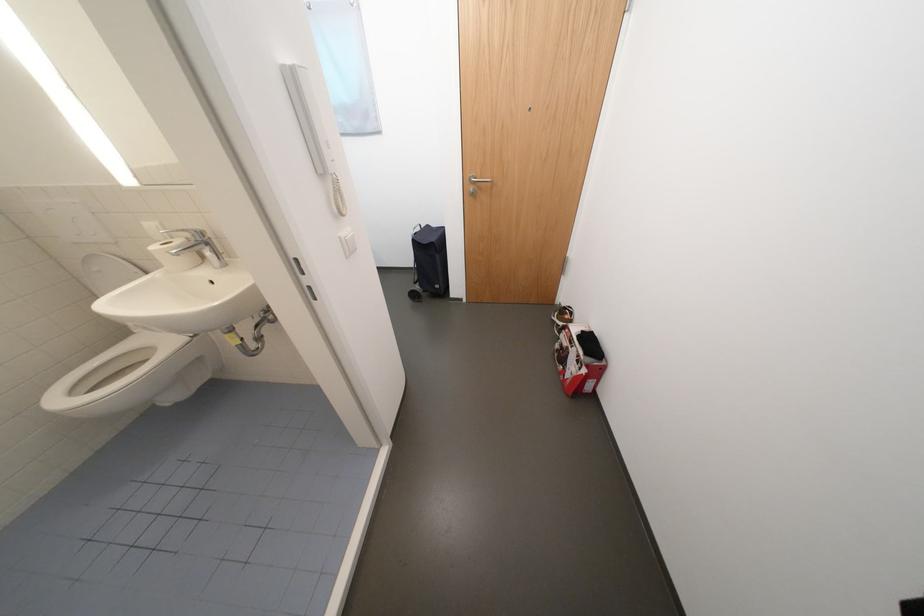
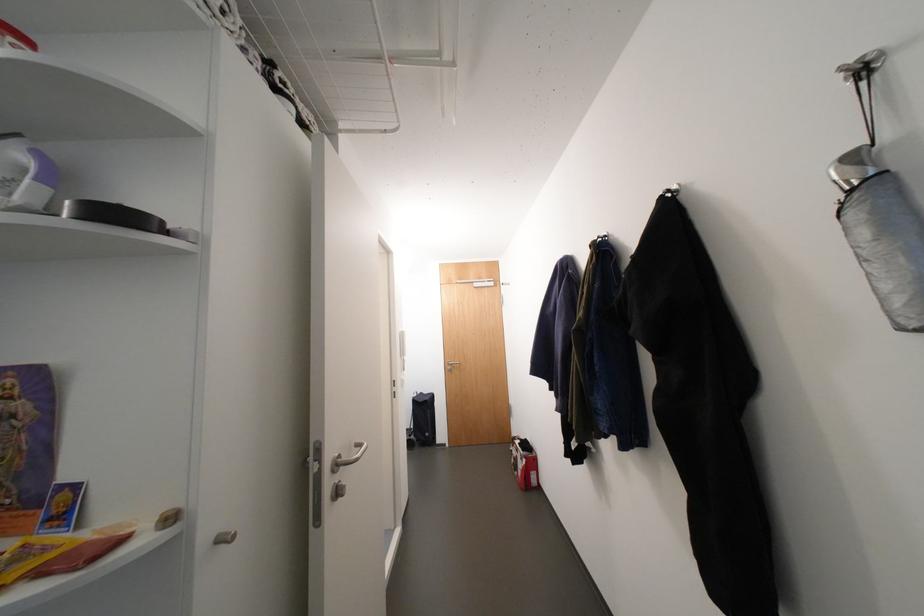
The point at (440,244) is marked in the first image. Where is the corresponding point in the second image?

(433, 402)